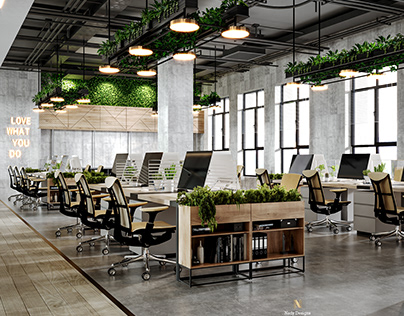
This screenshot has width=404, height=316. In order to click on books in this screenshot , I will do `click(245, 254)`, `click(240, 256)`, `click(235, 256)`, `click(229, 256)`, `click(225, 257)`, `click(219, 257)`.